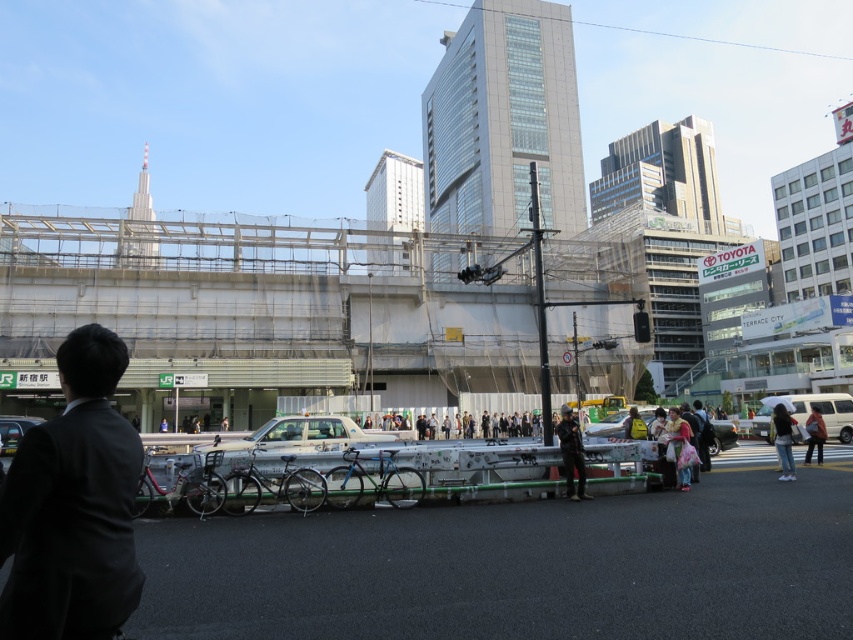
You are a pedestrian standing at the bus stop in the midground. You need to cross the street to reach the white matte van at right. The distance between you and the van is 26.77 meters. If you walk at a speed of 1.5 meters per second, how many seconds will it take you to reach the van?

It will take approximately 17.85 seconds to reach the white matte van at right since 26.77 meters divided by 1.5 meters per second equals approximately 17.85 seconds.

You are a pedestrian trying to cross the road. You see the white glossy taxi at center and the metallic silver car at center. Which vehicle is closer to the road?

The white glossy taxi at center is closer to the road because it is positioned below the metallic silver car at center, indicating it is lower in the image and thus nearer to the road level.

You are a pedestrian standing at the intersection near the black suit at lower left and the yellow matte car at center. Which object is closer to your left side?

The black suit at lower left is closer to your left side because it is positioned to the left of the yellow matte car at center.